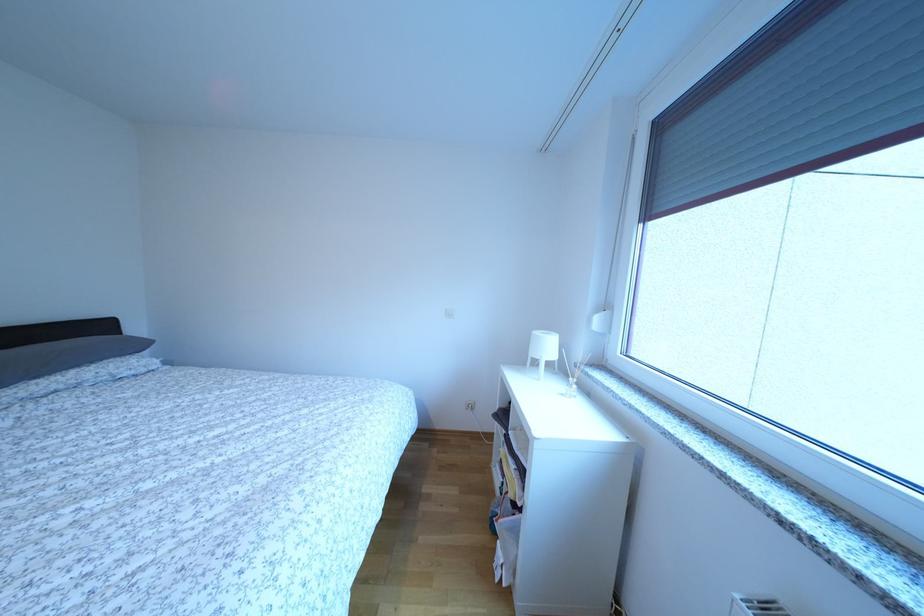
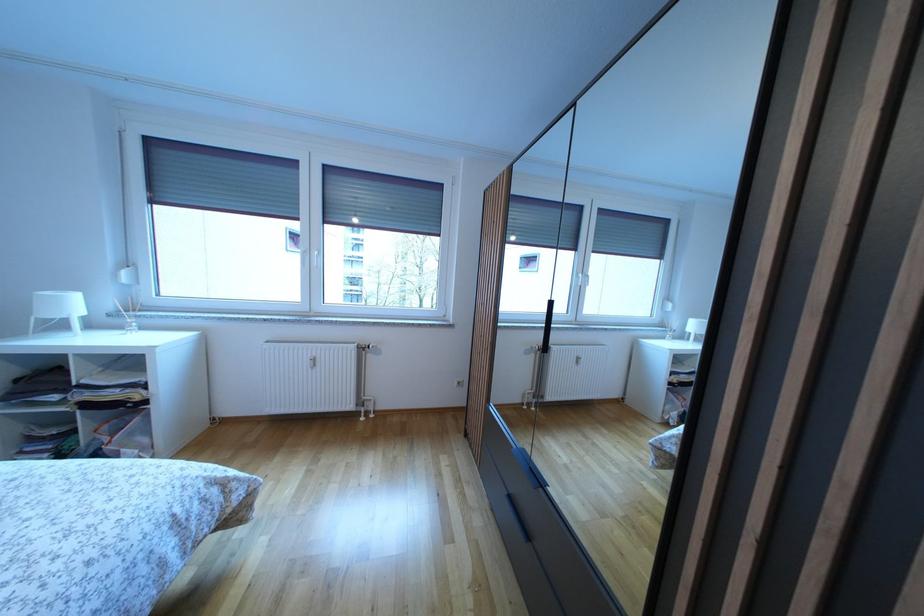
Find the pixel in the second image that matches [554,353] in the first image.

(78, 310)